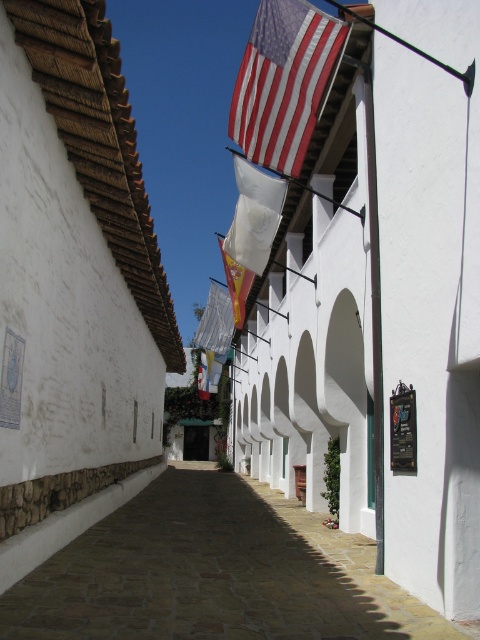
You are standing in the middle of the brown stone alley at center and want to hang a decorative banner that is 2 meters tall. Considering the height of the white fabric flag at center, will there be enough space to hang your banner without it touching the ground?

The brown stone alley at center is much taller than the white fabric flag at center, so there should be sufficient vertical space to hang a 2m tall banner without it touching the ground.